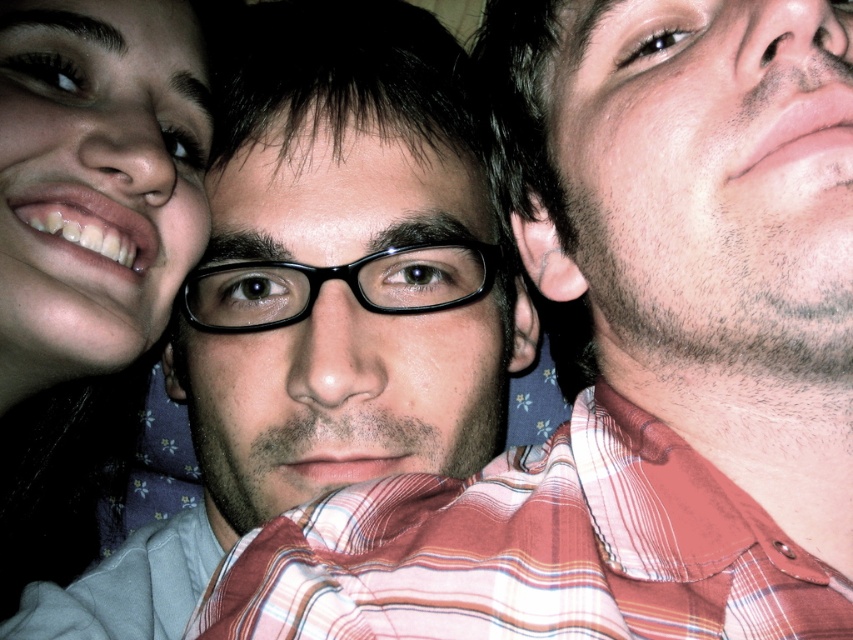
In the image, you see two pairs of glasses, the black matte glasses at center and the matte black glasses at left. Which pair is positioned lower in the frame?

The black matte glasses at center is positioned lower in the frame than the matte black glasses at left.